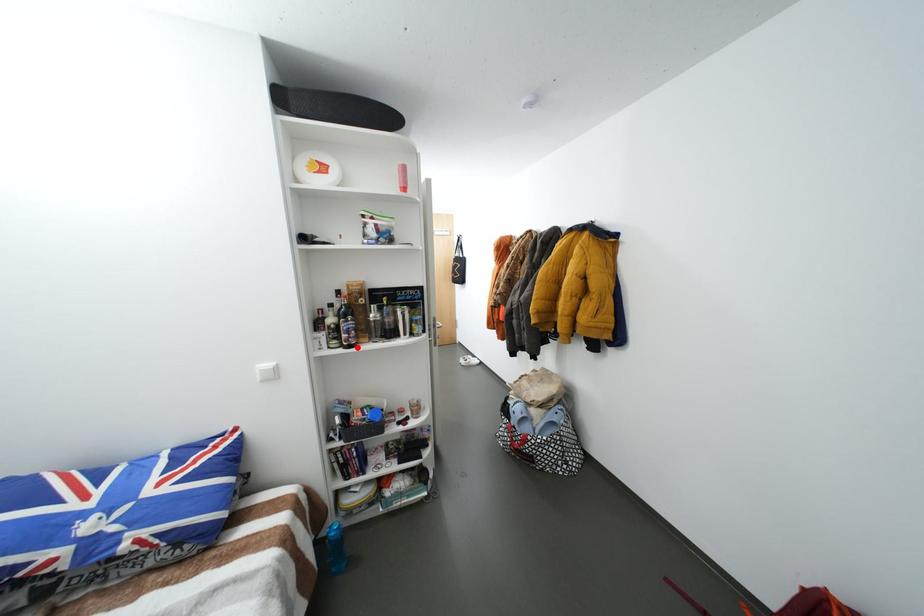
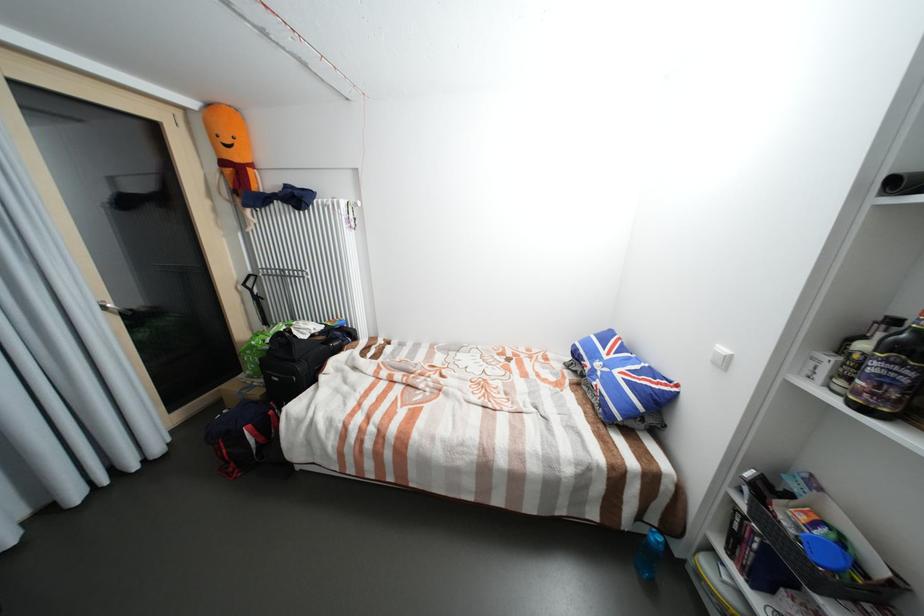
In the second image, find the point that corresponds to the highlighted location in the first image.

(870, 410)